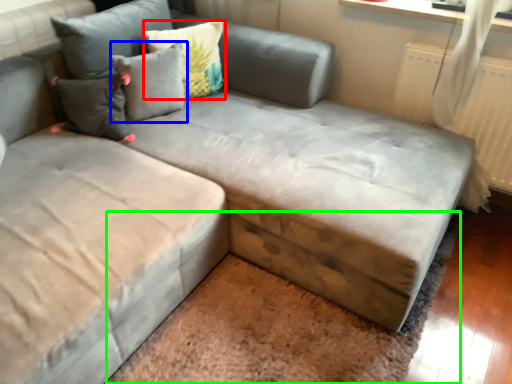
Question: Which object is the farthest from pillow (highlighted by a red box)? Choose among these: pillow (highlighted by a blue box) or mat (highlighted by a green box).

Choices:
 (A) pillow
 (B) mat

Answer: (B)